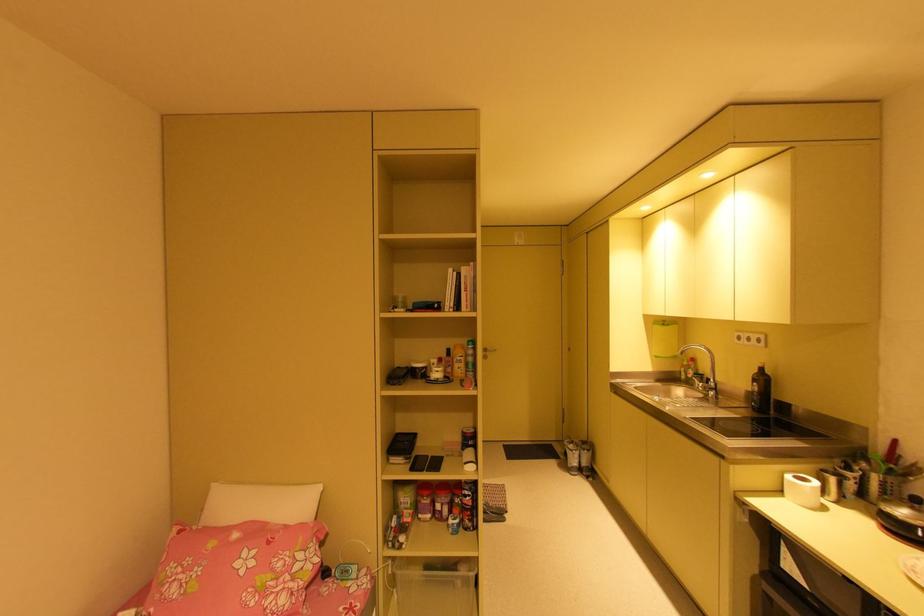
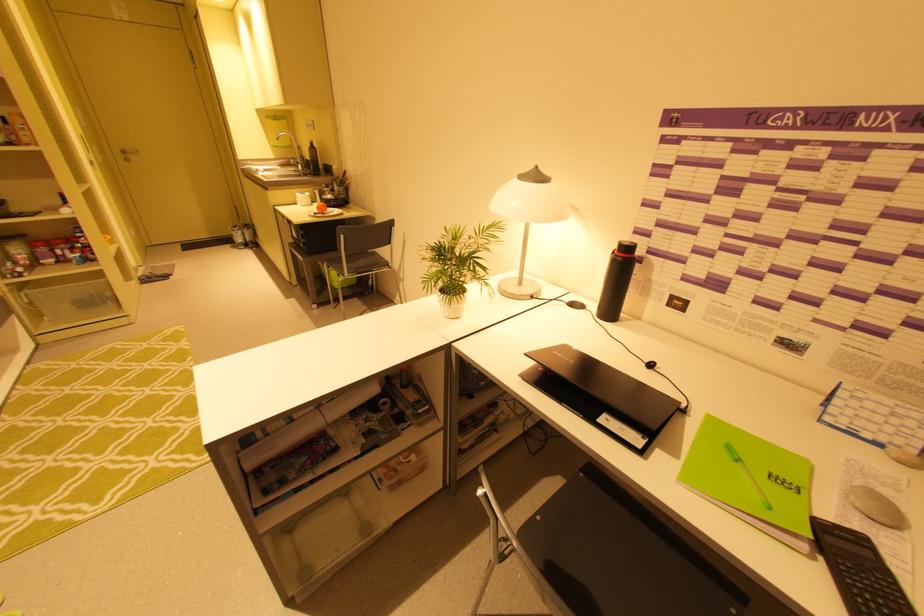
Where in the second image is the point corresponding to point 675,379 from the first image?

(293, 164)